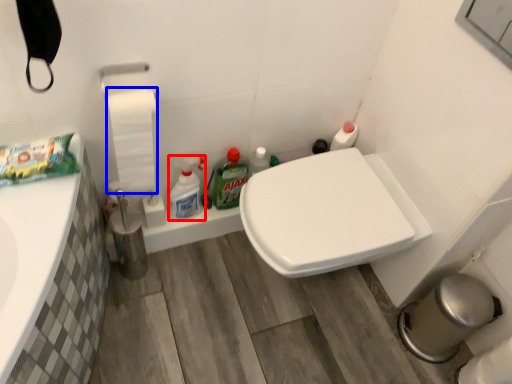
Question: Which point is further to the camera, cleaning product (highlighted by a red box) or toilet paper (highlighted by a blue box)?

Choices:
 (A) cleaning product
 (B) toilet paper

Answer: (A)